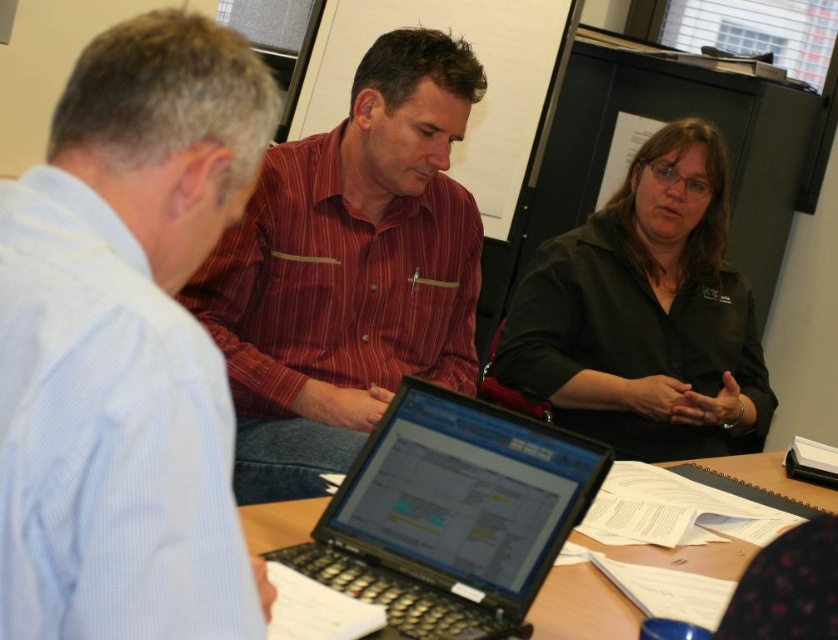
Based on the scene, which object is bigger between the red striped shirt at center and the wooden table at center?

The red striped shirt at center is larger in size than the wooden table at center.

You are a security camera positioned above the meeting table. You need to determine which person is closer to the camera between the blue striped shirt at upper left and the red striped shirt at center. Based on their positions, which one is closer?

The blue striped shirt at upper left is in front of the red striped shirt at center, so the blue striped shirt at upper left is closer to the camera.

You are standing at the entrance of the office and see two points marked on the floor. The first point is at coordinate point(365, 376) and the second point is at coordinate point(645, 563). Which point is closer to you?

Point(645, 563) is closer to you because it is in front of point(365, 376).